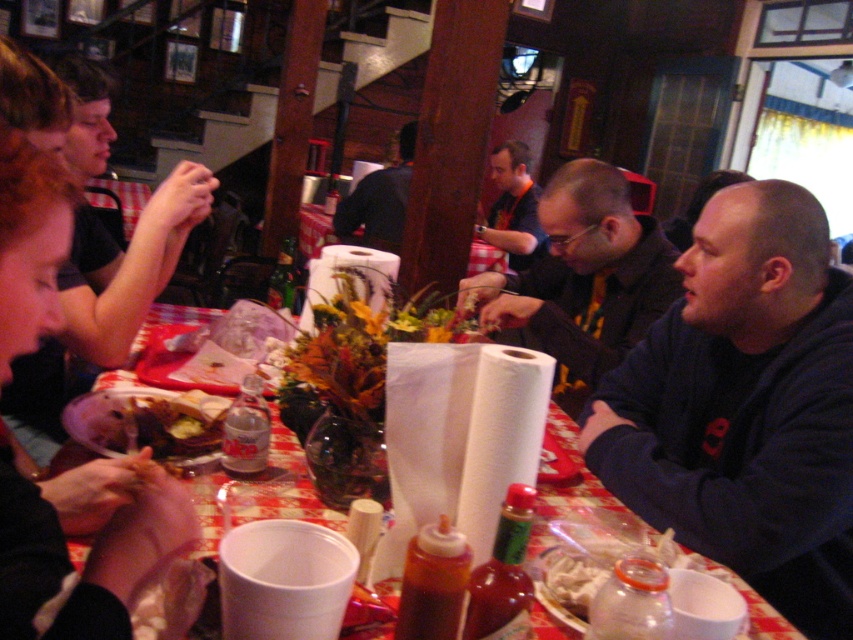
You are a customer sitting at the table and want to grab your smooth black hair at upper left and matte black shirt at center. Which item is easier to reach without moving your seat?

The smooth black hair at upper left is closer to the viewer than the matte black shirt at center, so it is easier to reach without moving your seat.

You are a waiter at the restaurant and need to place a new dish on the table. The dish must be placed between the two points labeled point (209, 445) and point (654, 541). Which point should the dish be closer to if it needs to be placed closer to the back of the table?

The dish should be placed closer to point (209, 445) because it is behind point (654, 541), so the back of the table is in the direction of point (209, 445).

You are a server at the restaurant and need to place a new dish on the table. There are two points marked on the table where you can place it. The first point is at coordinates point (x=189, y=529) and the second is at point (x=579, y=385). Which point is closer to you as you stand at the server position?

Point (x=189, y=529) is in front of point (x=579, y=385), so it is closer to your position as the server.